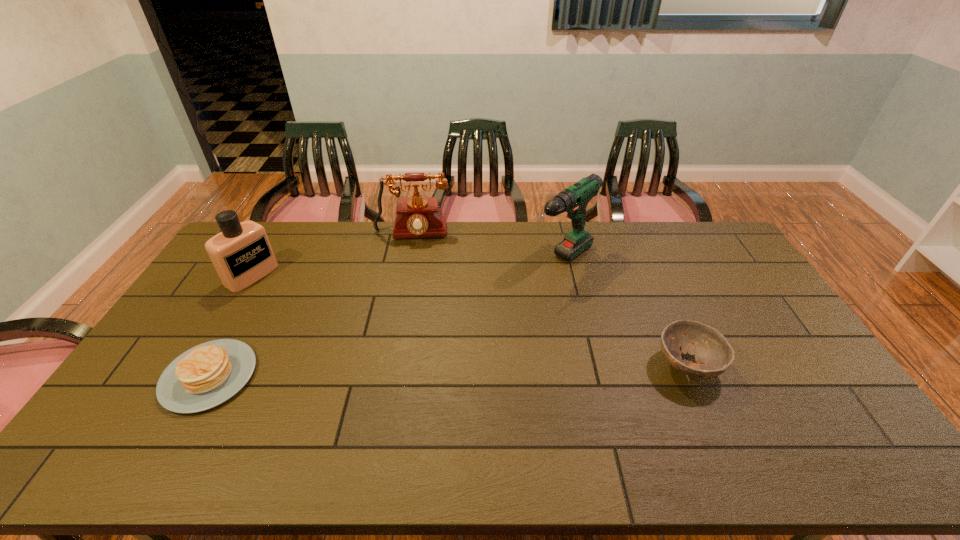
This screenshot has width=960, height=540. In order to click on vacant region between the fourth tallest object and the third object from right to left in this screenshot , I will do `click(550, 300)`.

You are a GUI agent. You are given a task and a screenshot of the screen. Output one action in this format:
    pyautogui.click(x=<x>, y=<y>)
    Task: Click on the vacant space that is in between the perfume and the third object from right to left
    
    Given the screenshot: What is the action you would take?
    pyautogui.click(x=332, y=255)

At what (x,y) coordinates should I click in order to perform the action: click on free spot between the bowl and the third object from right to left. Please return your answer as a coordinate pair (x, y). This screenshot has height=540, width=960. Looking at the image, I should click on (550, 300).

Where is `free space between the second shortest object and the telephone`? This screenshot has width=960, height=540. free space between the second shortest object and the telephone is located at coordinates (550, 300).

This screenshot has width=960, height=540. Identify the location of vacant space that is in between the third object from left to right and the shortest object. (311, 305).

The image size is (960, 540). Identify the location of free space between the tallest object and the pancake. 385,319.

In order to click on free spot between the perfume and the fourth tallest object in this screenshot , I will do `click(469, 320)`.

At what (x,y) coordinates should I click in order to perform the action: click on empty location between the shortest object and the second object from right to left. Please return your answer as a coordinate pair (x, y). The height and width of the screenshot is (540, 960). Looking at the image, I should click on (385, 319).

The height and width of the screenshot is (540, 960). I want to click on empty space between the pancake and the telephone, so click(311, 305).

Find the location of a particular element. The width and height of the screenshot is (960, 540). vacant point located between the third object from right to left and the fourth tallest object is located at coordinates (550, 300).